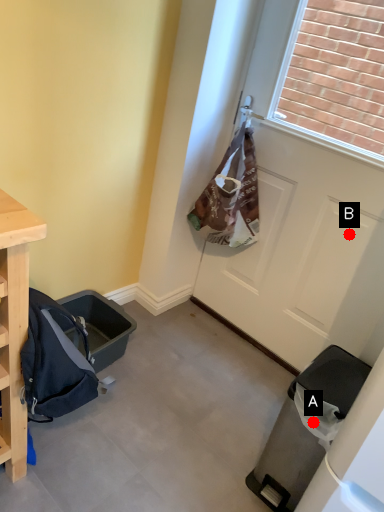
Question: Two points are circled on the image, labeled by A and B beside each circle. Which point is closer to the camera?

Choices:
 (A) A is closer
 (B) B is closer

Answer: (A)